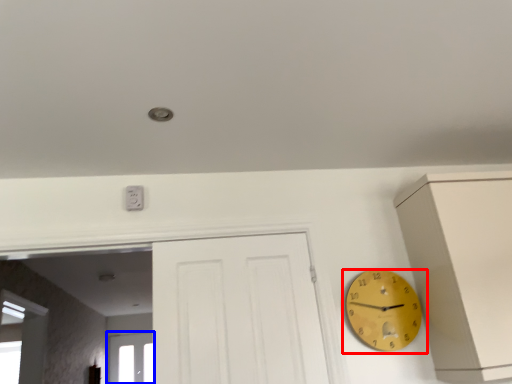
Question: Which object is further to the camera taking this photo, wall clock (highlighted by a red box) or window (highlighted by a blue box)?

Choices:
 (A) wall clock
 (B) window

Answer: (B)